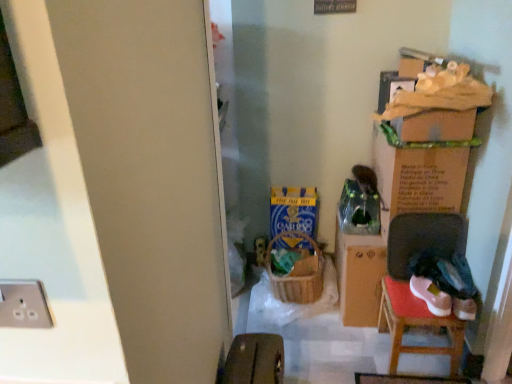
Find the location of a particular element. This screenshot has width=512, height=384. free space in front of woven brown laundry basket at center is located at coordinates (297, 324).